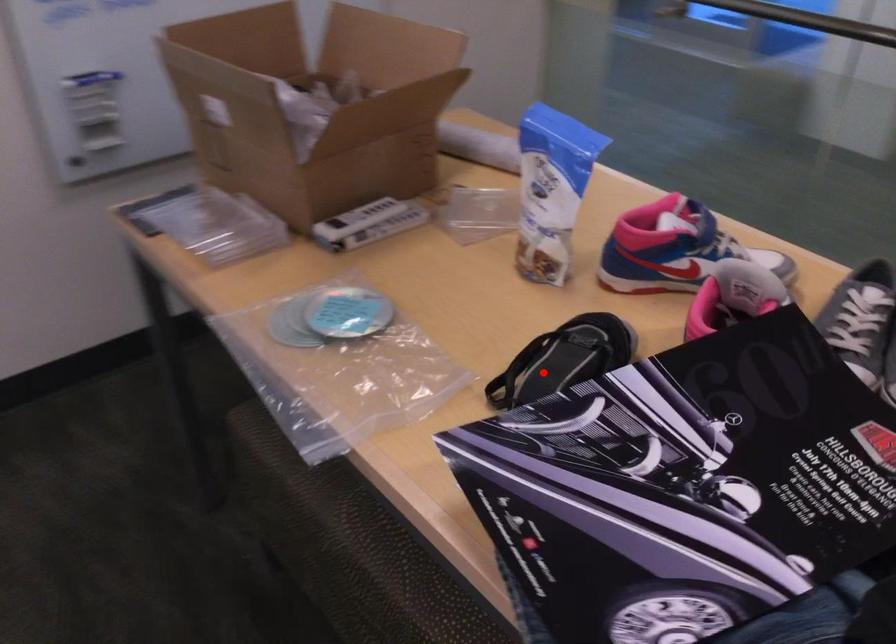
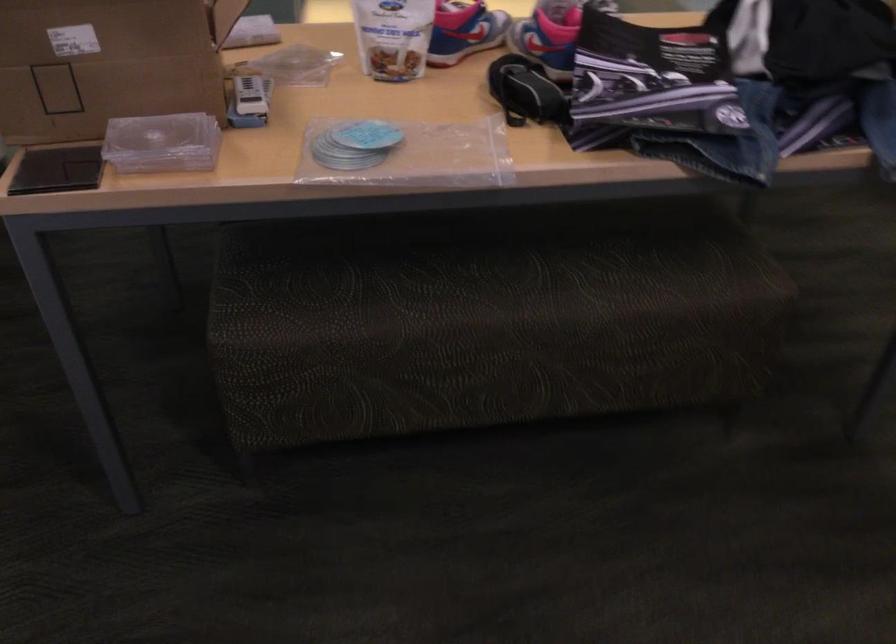
Find the pixel in the second image that matches the highlighted location in the first image.

(524, 91)